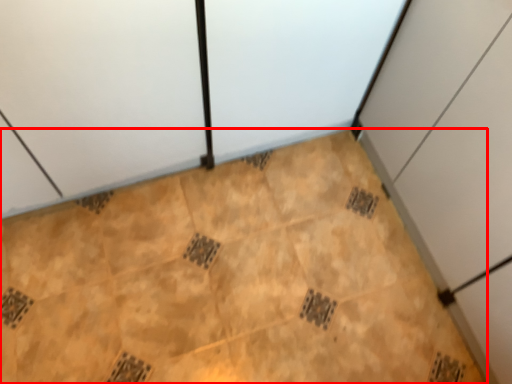
Question: From the image, what is the correct spatial relationship of ceramic tile (annotated by the red box) in relation to cabinetry?

Choices:
 (A) right
 (B) left

Answer: (B)